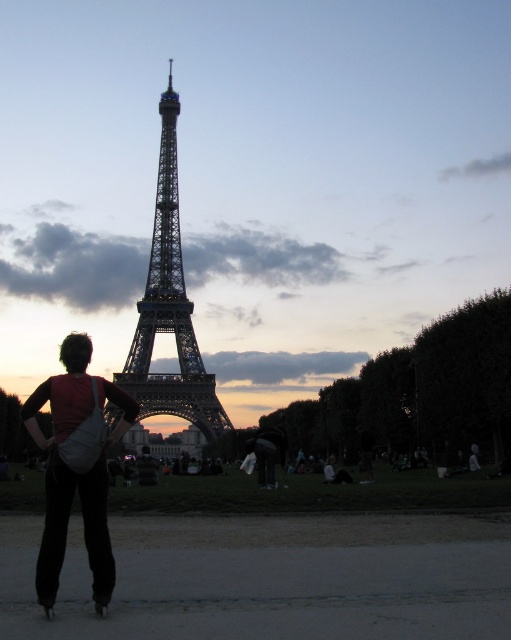
You are a tourist at the Trocadero Gardens in Paris with a matte white bag at lower left. You want to take a photo of the metallic structure at center without the bag blocking the view. Where should you move to achieve this?

The metallic structure at center is behind the matte white bag at lower left. To avoid the bag blocking the view, you should move to the right side of the matte white bag at lower left so that the bag is no longer between you and the metallic structure at center.

Looking at this image, you are a photographer planning to take a photo of the Eiffel Tower from the Trocadero Gardens. You have a matte white bag at lower left and a metallic structure at center in your shot. To ensure both objects are visible without overlapping, which object should you move closer to the camera?

You should move the matte white bag at lower left closer to the camera because it occupies less space than the metallic structure at center, so moving it closer would help prevent overlapping while keeping both in frame.